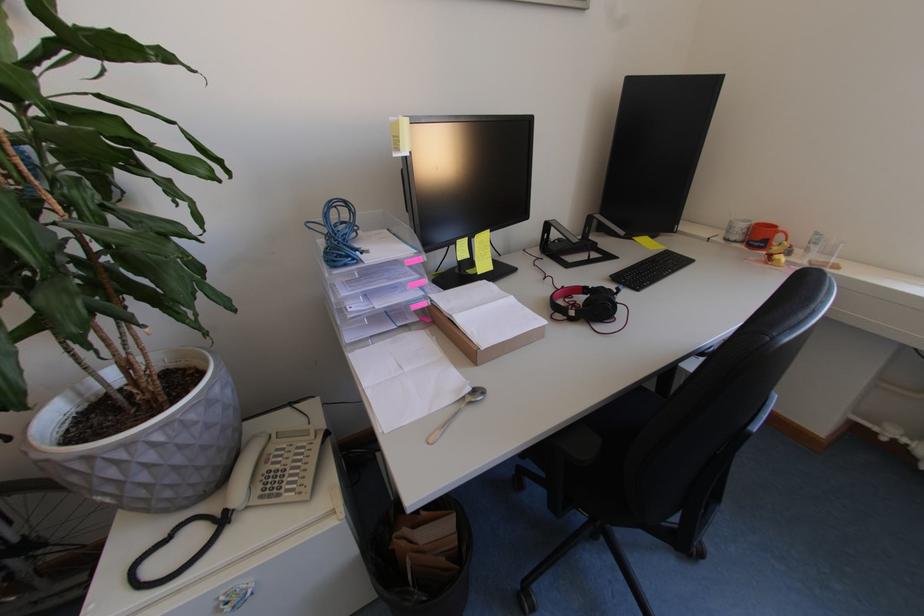
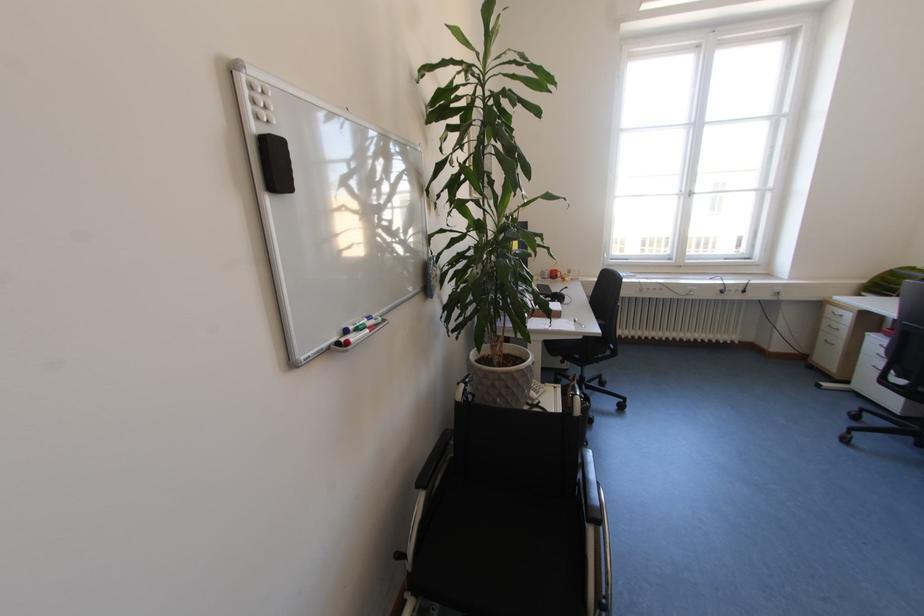
In the second image, find the point that corresponds to (287,496) in the first image.

(546, 392)